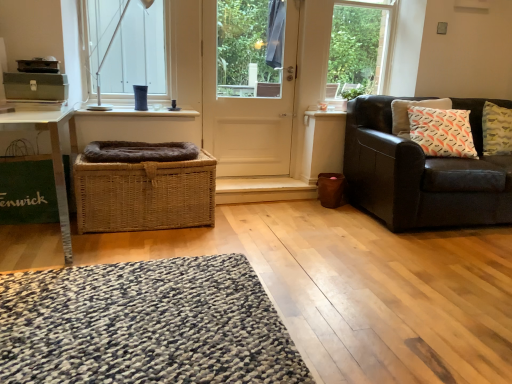
Question: Do you think textured gray mat at lower left is within dark brown leather couch at right, or outside of it?

Choices:
 (A) inside
 (B) outside

Answer: (B)

Question: Considering the positions of textured gray mat at lower left and dark brown leather couch at right in the image, is textured gray mat at lower left bigger or smaller than dark brown leather couch at right?

Choices:
 (A) small
 (B) big

Answer: (A)

Question: Which of these objects is positioned farthest from the white glossy window sill at upper center?

Choices:
 (A) woven brown basket at center
 (B) white wood window frame at upper center
 (C) textured gray mat at lower left
 (D) metallic silver table at lower left
 (E) white matte door at center

Answer: (B)

Question: Estimate the real-world distances between objects in this image. Which object is farther from the white matte door at center?

Choices:
 (A) white wood window frame at upper center
 (B) textured gray mat at lower left
 (C) metallic silver table at lower left
 (D) white glass window at upper left
 (E) white glossy window sill at upper center

Answer: (B)